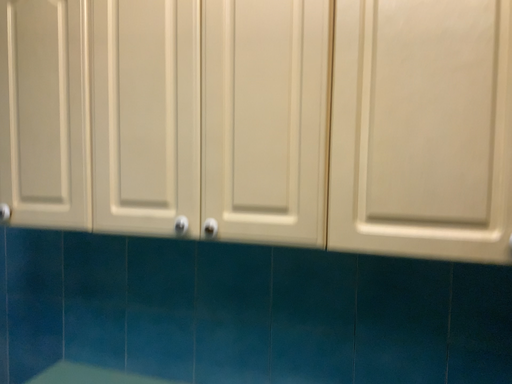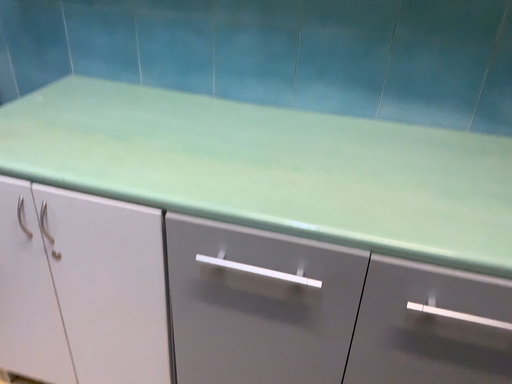
Question: How did the camera likely rotate when shooting the video?

Choices:
 (A) rotated downward
 (B) rotated upward

Answer: (A)